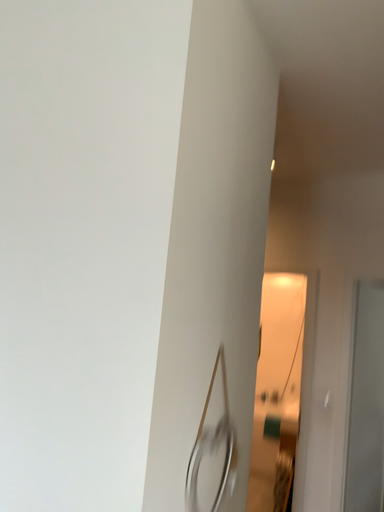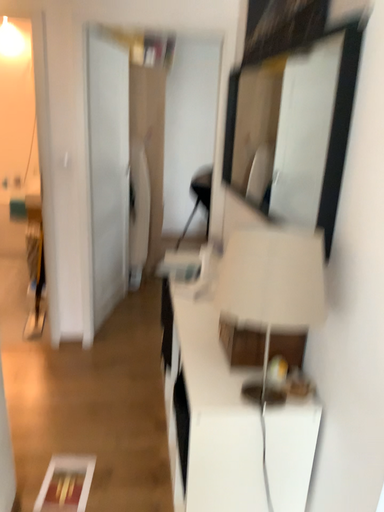
Question: How did the camera likely rotate when shooting the video?

Choices:
 (A) rotated left
 (B) rotated right

Answer: (B)